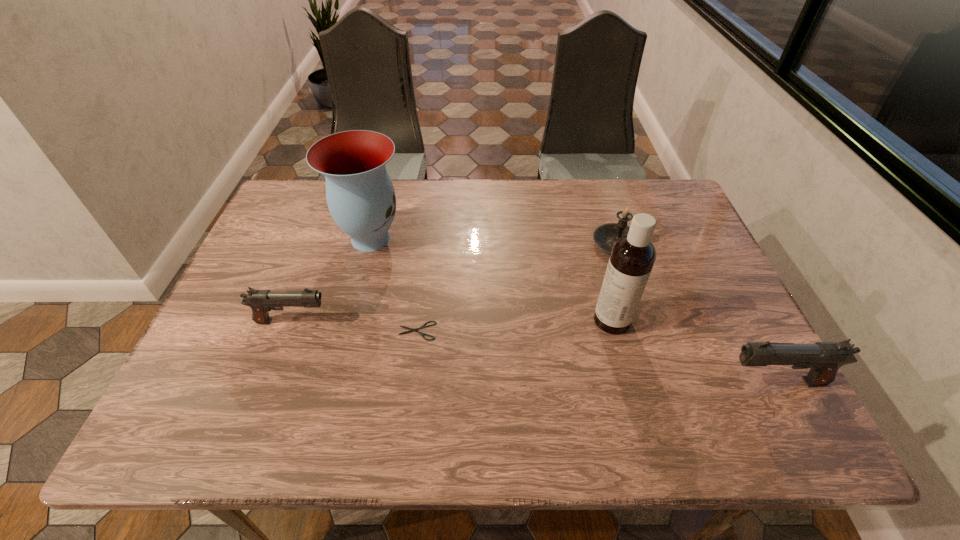
The height and width of the screenshot is (540, 960). What are the coordinates of `object present at the near edge` in the screenshot? It's located at (824, 359).

At what (x,y) coordinates should I click in order to perform the action: click on object located in the left edge section of the desktop. Please return your answer as a coordinate pair (x, y). Looking at the image, I should click on (261, 302).

Where is `object that is positioned at the right edge`? The height and width of the screenshot is (540, 960). object that is positioned at the right edge is located at coordinates (824, 359).

Identify the location of object that is at the near right corner. (824, 359).

You are a GUI agent. You are given a task and a screenshot of the screen. Output one action in this format:
    pyautogui.click(x=<x>, y=<y>)
    Task: Click on the free region at the far edge of the desktop
    
    Given the screenshot: What is the action you would take?
    pyautogui.click(x=565, y=191)

In the image, there is a desktop. Identify the location of free space at the near edge. (288, 370).

The image size is (960, 540). In order to click on vacant point at the right edge in this screenshot , I will do `click(686, 259)`.

Where is `free location at the far right corner`? The image size is (960, 540). free location at the far right corner is located at coordinates (647, 185).

You are a GUI agent. You are given a task and a screenshot of the screen. Output one action in this format:
    pyautogui.click(x=<x>, y=<y>)
    Task: Click on the vacant area that lies between the shorter gun and the taller gun
    Image resolution: width=960 pixels, height=540 pixels.
    Given the screenshot: What is the action you would take?
    pyautogui.click(x=534, y=352)

Locate an element on the screen. The image size is (960, 540). vacant region between the shortest object and the left gun is located at coordinates (354, 326).